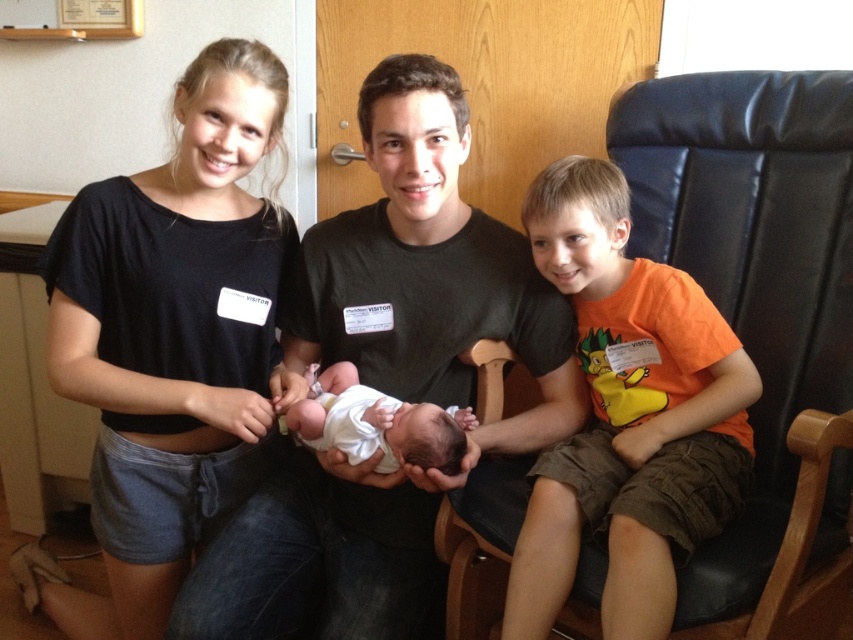
You are a photographer taking a portrait of the black cotton shirt at upper left and the white soft newborn at center. Which object should you focus on first to ensure both are in sharp focus?

The black cotton shirt at upper left is positioned under the white soft newborn at center, so you should focus on the black cotton shirt at upper left first to ensure both are in sharp focus.

You are standing 5 feet away from the camera and want to take a photo of the matte black shirt at center. Can you reach it without moving your position?

The matte black shirt at center is 3.54 feet away from the camera. Since you are 5 feet away from the camera, you are farther than the shirt, so you cannot reach it without moving closer.